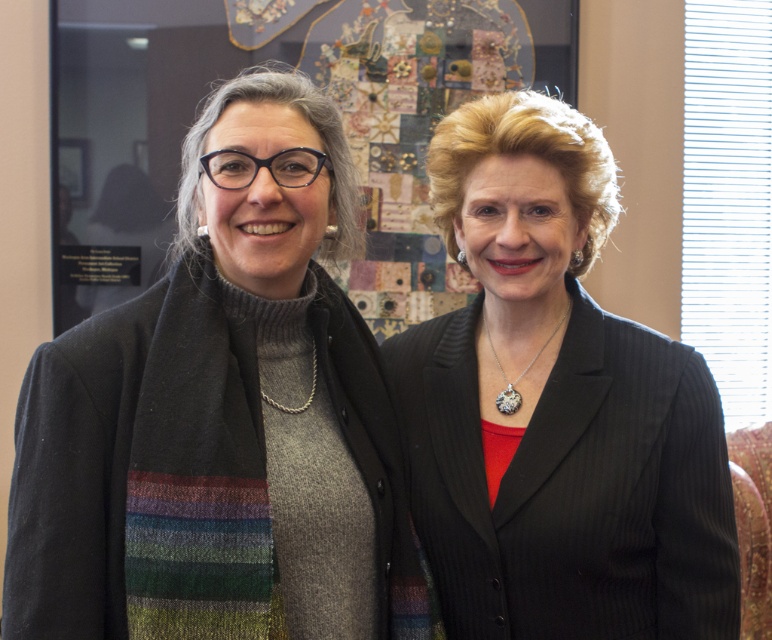
Question: In this image, where is knitted scarf at center located relative to black pinstripe suit at center?

Choices:
 (A) left
 (B) right

Answer: (A)

Question: Does knitted scarf at center have a larger size compared to black pinstripe suit at center?

Choices:
 (A) yes
 (B) no

Answer: (A)

Question: Does knitted scarf at center appear under black pinstripe suit at center?

Choices:
 (A) no
 (B) yes

Answer: (A)

Question: Which point is closer to the camera taking this photo?

Choices:
 (A) (154, 440)
 (B) (461, 458)

Answer: (A)